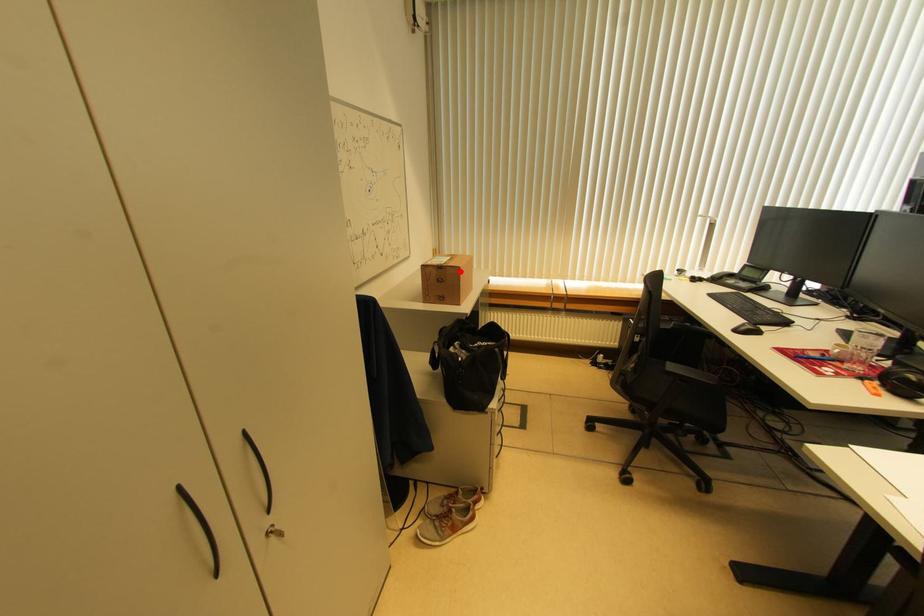
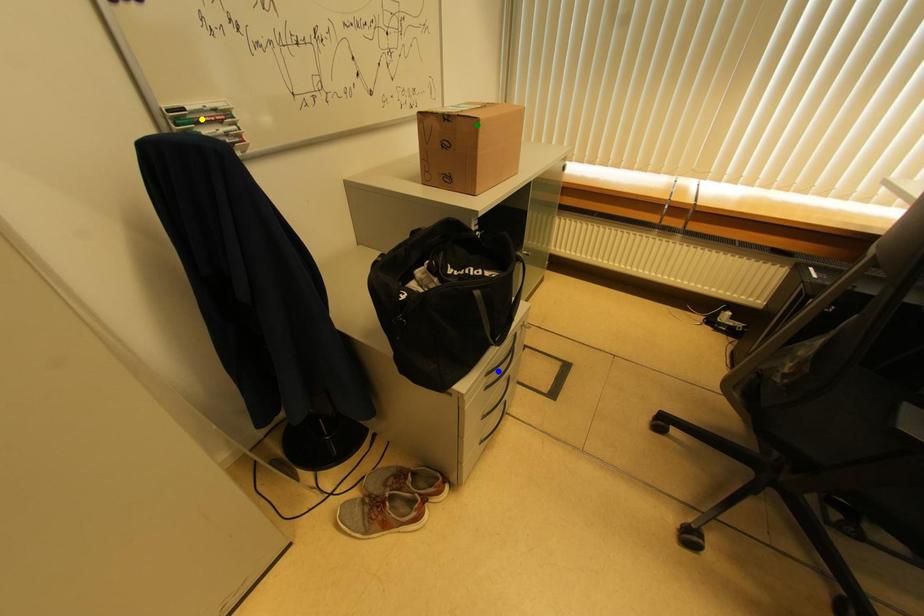
Question: I am providing you with two images of the same scene from different viewpoints. A red point is marked on the first image. You are given multiple points on the second image. Which spot in image 2 lines up with the point in image 1?

Choices:
 (A) green point
 (B) blue point
 (C) yellow point

Answer: (A)